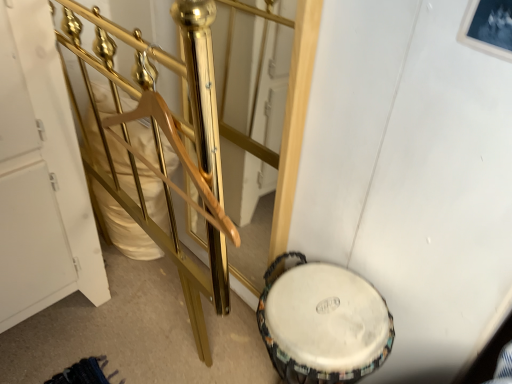
Question: Do you think gold polished metal rail at center is within white fabric drum at lower right, or outside of it?

Choices:
 (A) inside
 (B) outside

Answer: (B)

Question: Does point (121, 39) appear closer or farther from the camera than point (385, 349)?

Choices:
 (A) farther
 (B) closer

Answer: (B)

Question: Is gold polished metal rail at center in front of or behind white fabric drum at lower right in the image?

Choices:
 (A) behind
 (B) front

Answer: (B)

Question: From the image's perspective, is white fabric drum at lower right positioned above or below gold polished metal rail at center?

Choices:
 (A) below
 (B) above

Answer: (A)

Question: Would you say white fabric drum at lower right is to the left or to the right of gold polished metal rail at center in the picture?

Choices:
 (A) left
 (B) right

Answer: (B)

Question: Is white fabric drum at lower right taller or shorter than gold polished metal rail at center?

Choices:
 (A) tall
 (B) short

Answer: (A)

Question: Which is correct: white fabric drum at lower right is inside gold polished metal rail at center, or outside of it?

Choices:
 (A) inside
 (B) outside

Answer: (B)